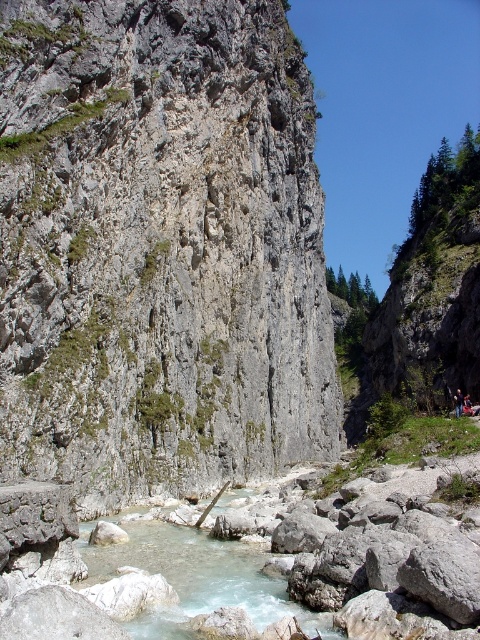
Question: Is gray rough rock at center bigger than clear quartz water at center?

Choices:
 (A) no
 (B) yes

Answer: (B)

Question: Is gray rough rock at center smaller than clear quartz water at center?

Choices:
 (A) yes
 (B) no

Answer: (B)

Question: Which point is closer to the camera?

Choices:
 (A) (139, 51)
 (B) (139, 516)

Answer: (B)

Question: From the image, what is the correct spatial relationship of gray rough rock at center in relation to clear quartz water at center?

Choices:
 (A) left
 (B) right

Answer: (B)